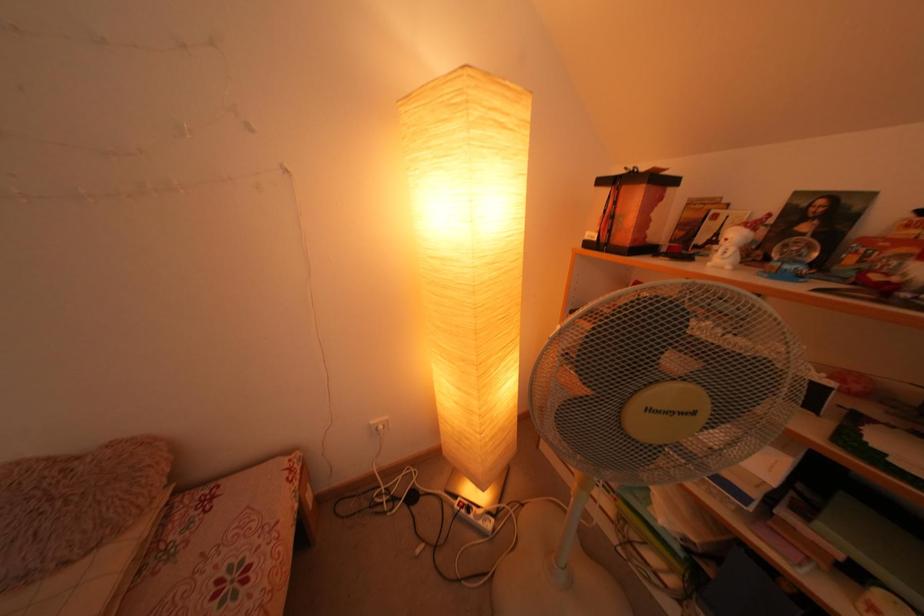
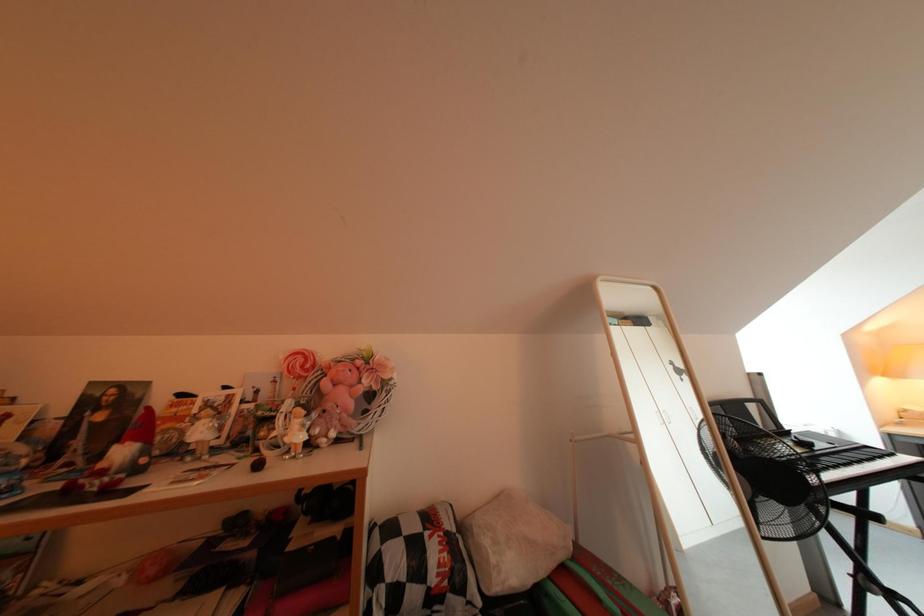
Question: The camera is either moving clockwise (left) or counter-clockwise (right) around the object. The first image is from the beginning of the video and the second image is from the end. Is the camera moving left or right when shooting the video?

Choices:
 (A) Left
 (B) Right

Answer: (A)